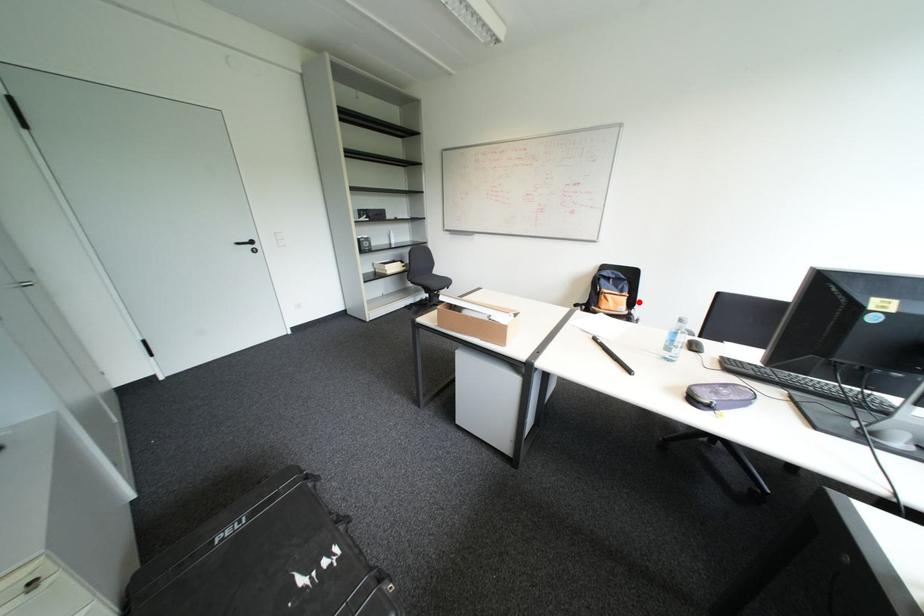
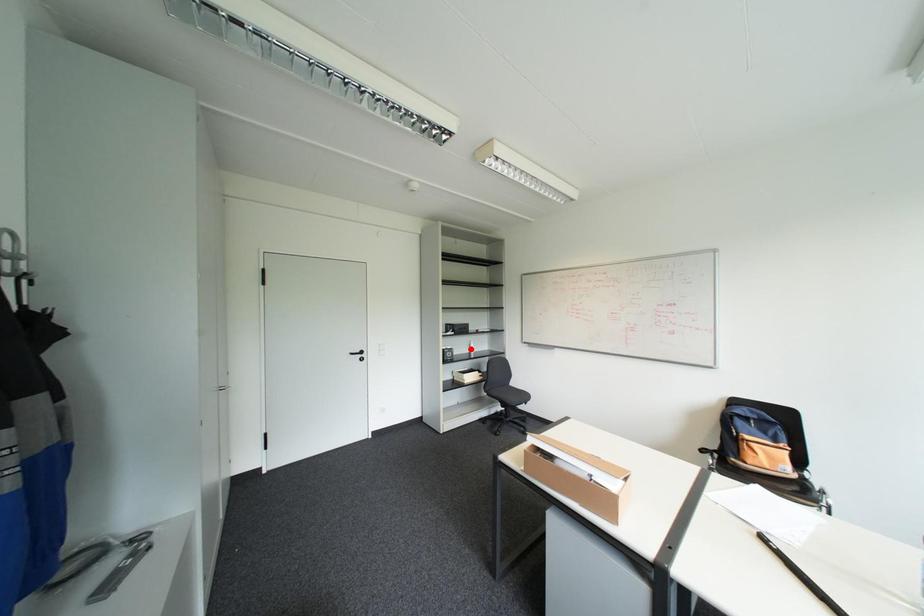
I am providing you with two images of the same scene from different viewpoints. A red point is marked on the first image and another point is marked on the second image. Are the points marked in image1 and image2 representing the same 3D position?

No